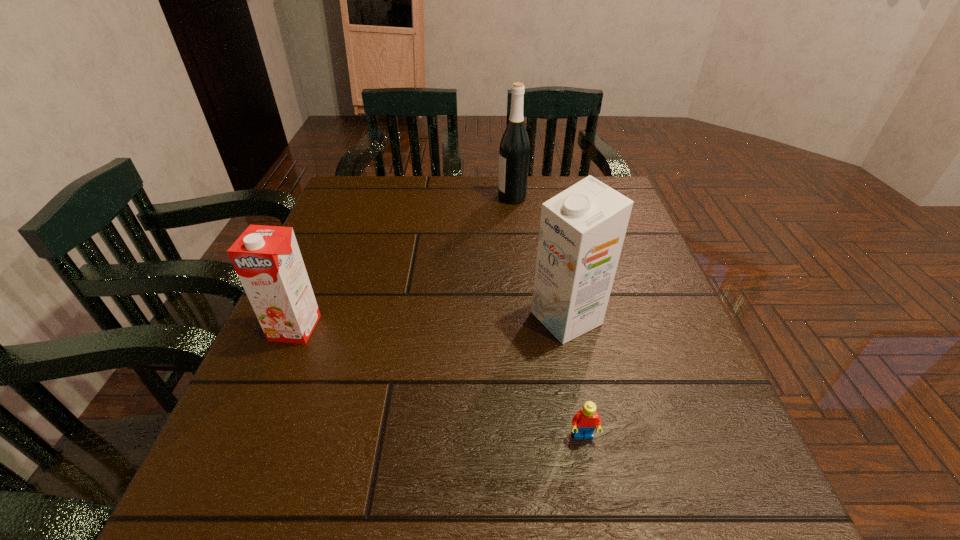
Identify the location of free spot located 0.150m on the back of the leftmost object. (322, 266).

This screenshot has height=540, width=960. I want to click on vacant space located on the face of the Lego, so click(597, 512).

At what (x,y) coordinates should I click in order to perform the action: click on object at the far edge. Please return your answer as a coordinate pair (x, y). The height and width of the screenshot is (540, 960). Looking at the image, I should click on (514, 151).

At what (x,y) coordinates should I click in order to perform the action: click on object at the left edge. Please return your answer as a coordinate pair (x, y). The height and width of the screenshot is (540, 960). Looking at the image, I should click on [267, 259].

The height and width of the screenshot is (540, 960). In order to click on object positioned at the right edge in this screenshot , I will do `click(582, 229)`.

In the image, there is a desktop. At what (x,y) coordinates should I click in order to perform the action: click on free space at the far edge. Please return your answer as a coordinate pair (x, y). Looking at the image, I should click on (552, 186).

This screenshot has width=960, height=540. In the image, there is a desktop. In order to click on free region at the near edge in this screenshot , I will do `click(375, 504)`.

I want to click on vacant space at the left edge, so pyautogui.click(x=313, y=357).

The image size is (960, 540). I want to click on vacant position at the right edge of the desktop, so click(x=638, y=275).

Locate an element on the screen. Image resolution: width=960 pixels, height=540 pixels. free area in between the Lego and the shorter carton is located at coordinates (439, 382).